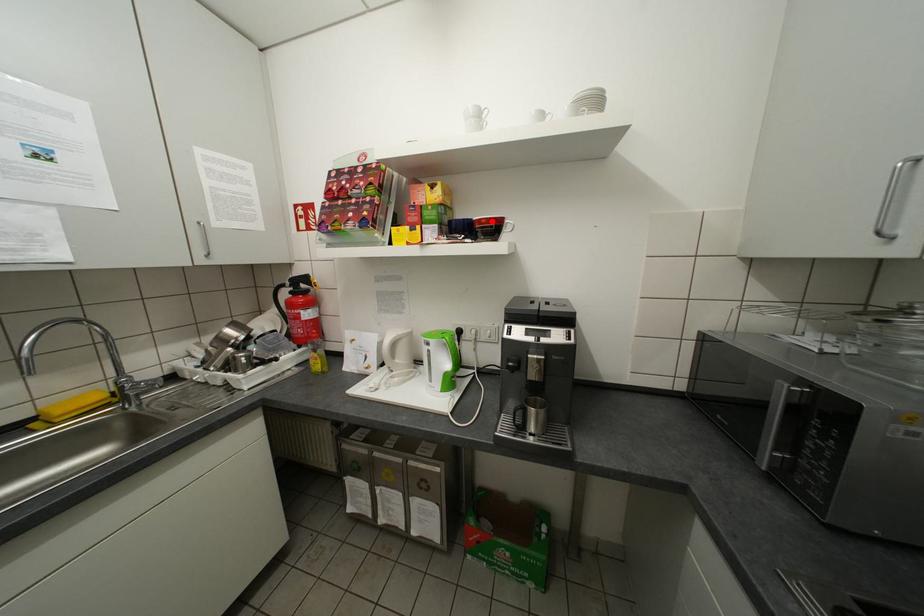
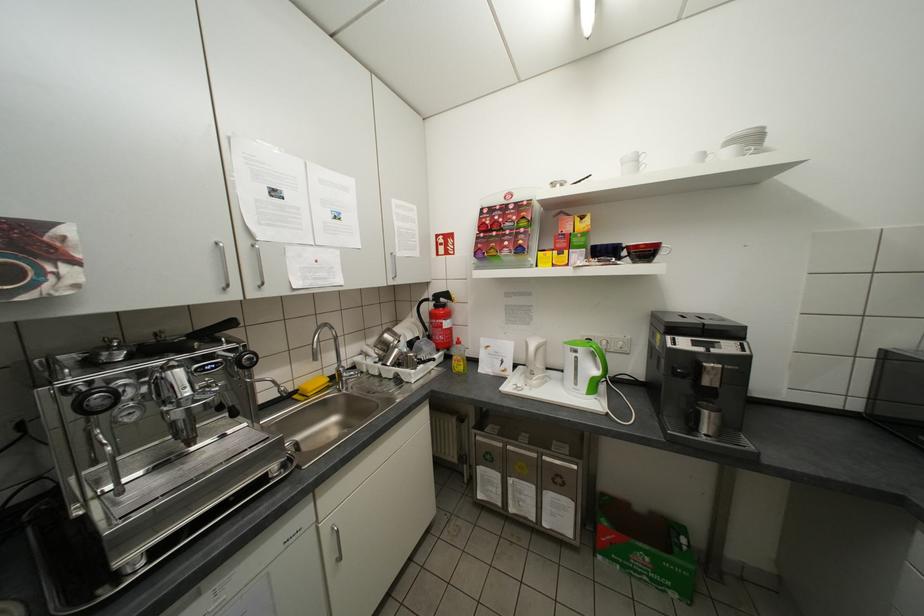
Find the pixel in the second image that matches the highlighted location in the first image.

(650, 246)